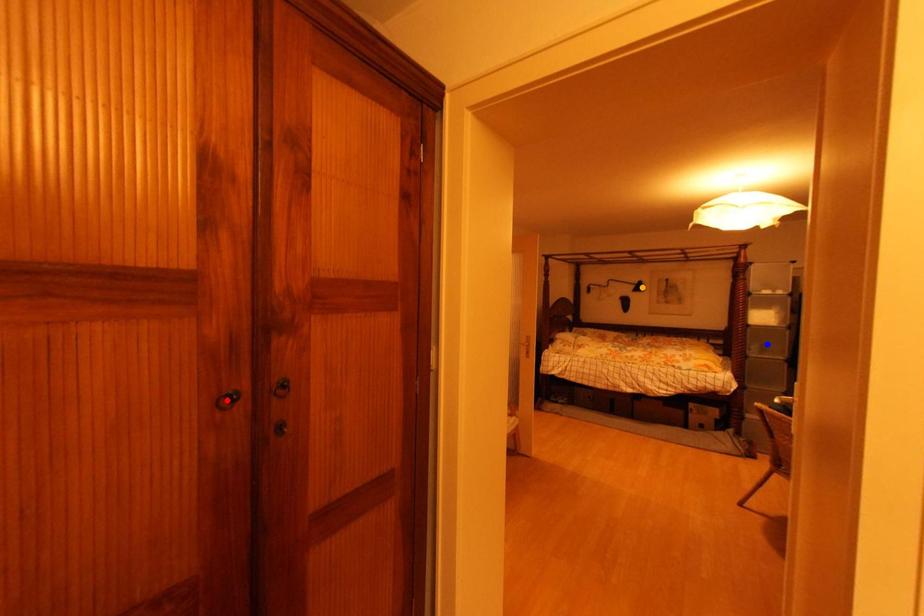
Order these from nearest to farthest:
blue point | red point | orange point

orange point → blue point → red point